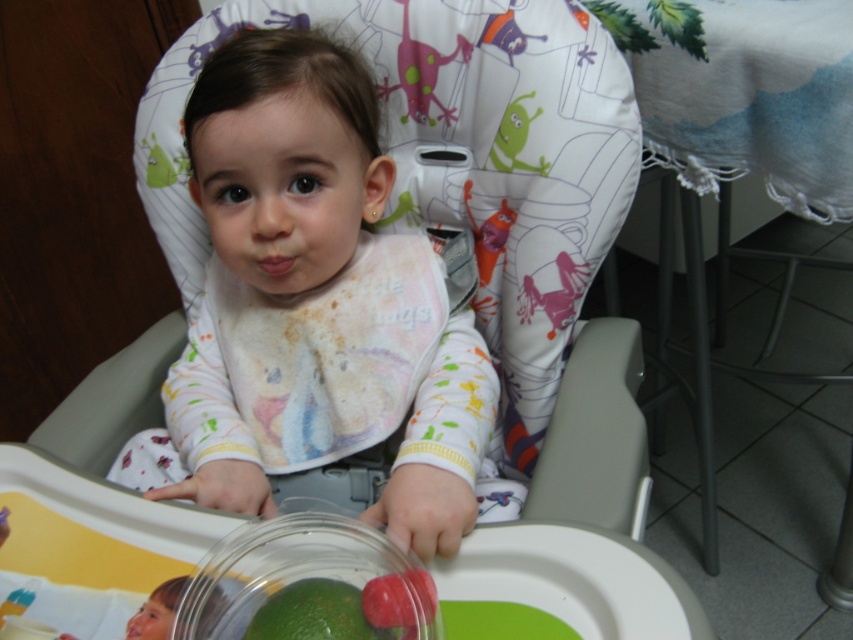
Is white soft bib at center bigger than green rubber toy at upper right?

Indeed, white soft bib at center has a larger size compared to green rubber toy at upper right.

Is the position of white soft bib at center more distant than that of green rubber toy at upper right?

No, it is not.

You are a GUI agent. You are given a task and a screenshot of the screen. Output one action in this format:
    pyautogui.click(x=<x>, y=<y>)
    Task: Click on the white soft bib at center
    
    Given the screenshot: What is the action you would take?
    pyautogui.click(x=312, y=307)

Is white soft bib at center positioned in front of transparent glass bowl at lower center?

No, white soft bib at center is behind transparent glass bowl at lower center.

Is white soft bib at center smaller than transparent glass bowl at lower center?

No, white soft bib at center is not smaller than transparent glass bowl at lower center.

This screenshot has height=640, width=853. What do you see at coordinates (312, 307) in the screenshot?
I see `white soft bib at center` at bounding box center [312, 307].

You are a GUI agent. You are given a task and a screenshot of the screen. Output one action in this format:
    pyautogui.click(x=<x>, y=<y>)
    Task: Click on the white soft bib at center
    This screenshot has width=853, height=640.
    Given the screenshot: What is the action you would take?
    pyautogui.click(x=312, y=307)

Which is behind, point (340, 586) or point (521, 93)?

Positioned behind is point (521, 93).

Which is in front, point (287, 596) or point (509, 156)?

Point (287, 596)

Is point (264, 611) positioned in front of point (532, 115)?

Yes, it is in front of point (532, 115).

Locate an element on the screen. This screenshot has height=640, width=853. green matte lime at lower center is located at coordinates (316, 612).